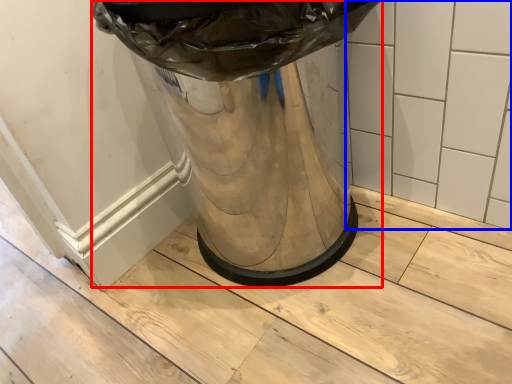
Question: Which of the following is the closest to the observer, waste container (highlighted by a red box) or tile (highlighted by a blue box)?

Choices:
 (A) waste container
 (B) tile

Answer: (A)